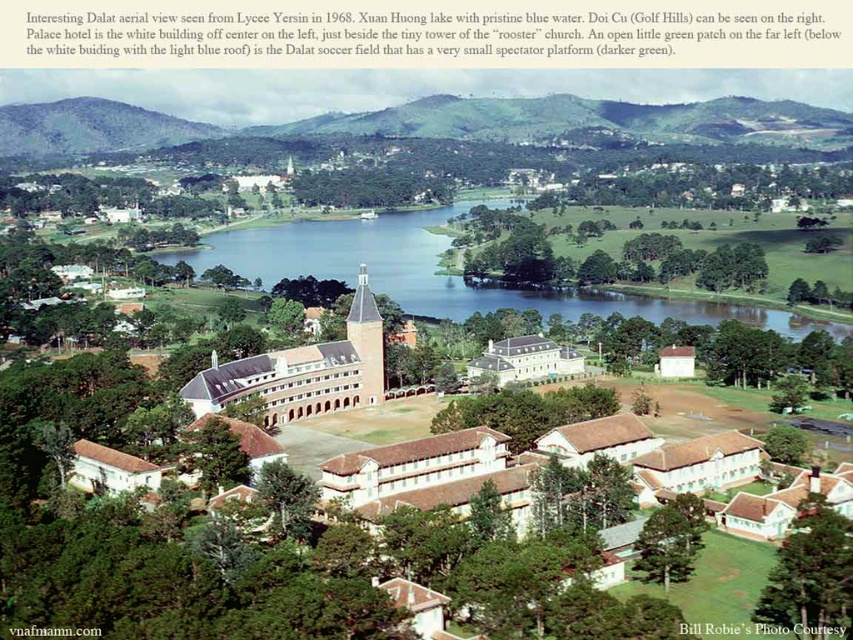
Which is above, clear blue water at center or green grassy hill at upper left?

green grassy hill at upper left is higher up.

How much distance is there between clear blue water at center and green grassy hill at upper left?

They are 480.59 feet apart.

The height and width of the screenshot is (640, 853). In order to click on clear blue water at center in this screenshot , I will do `click(440, 273)`.

Between matte beige building at center and white smooth building at center, which one is positioned higher?

Positioned higher is matte beige building at center.

Who is taller, matte beige building at center or white smooth building at center?

With more height is matte beige building at center.

Between point (186, 394) and point (515, 369), which one is positioned in front?

Point (186, 394)

Identify the location of matte beige building at center. (302, 371).

Measure the distance between beige brick building at center and green grassy hill at upper left.

beige brick building at center and green grassy hill at upper left are 337.35 meters apart from each other.

What do you see at coordinates (309, 369) in the screenshot? I see `beige brick building at center` at bounding box center [309, 369].

The width and height of the screenshot is (853, 640). I want to click on beige brick building at center, so click(x=309, y=369).